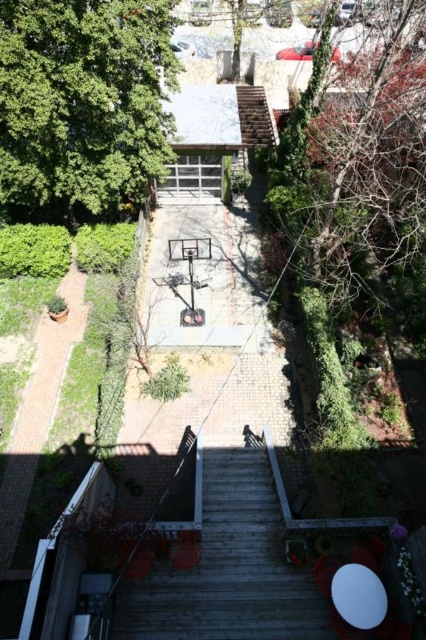
You are standing at the bottom of the wooden staircase with white railings and want to walk to the basketball hoop in the central area. There is a point marked at coordinates (x=356, y=161) on bare branches at upper right. Is this point between your current position and the basketball hoop?

The point marked at coordinates (x=356, y=161) on bare branches at upper right is not between your current position at the bottom of the wooden staircase with white railings and the basketball hoop in the central area, since it is located at the upper right area, away from the central path.

You are planning to install a new garden light in the backyard. The light requires a sturdy branch to hang it from. Based on the scene, which object between the green leafy tree at upper left and the bare branches at upper right would be more suitable for hanging the light?

The bare branches at upper right are more suitable for hanging the garden light because they are larger and sturdier than the green leafy tree at upper left.

You are standing at the top of the wooden staircase with white railings in the residential backyard. You want to reach a point that is 18.38 meters away from you. Is the point at coordinates point [83,195] the correct destination?

Yes, the point at point [83,195] is 18.38 meters away from you, so it is the correct destination.